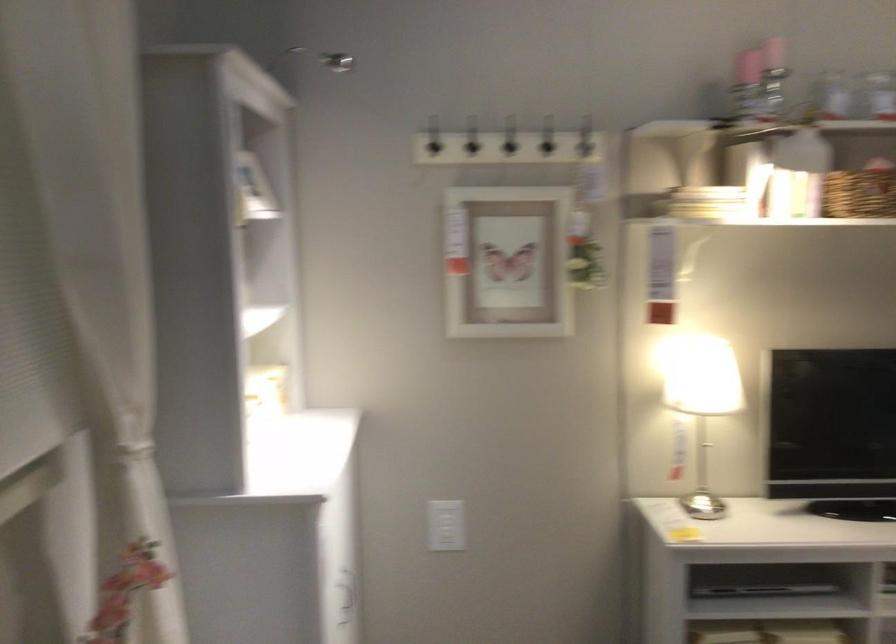
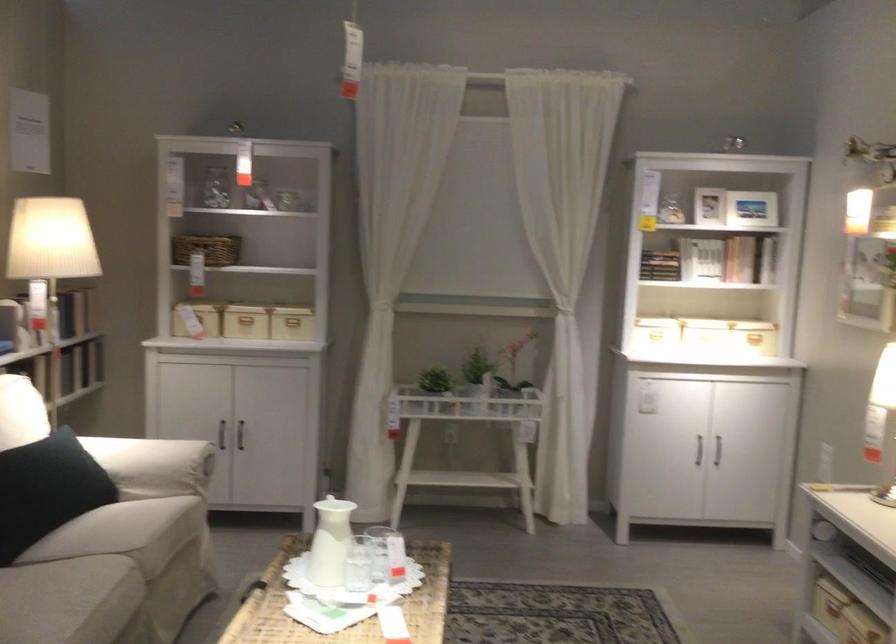
Where in the second image is the point corresponding to the point at 192,339 from the first image?

(659, 265)